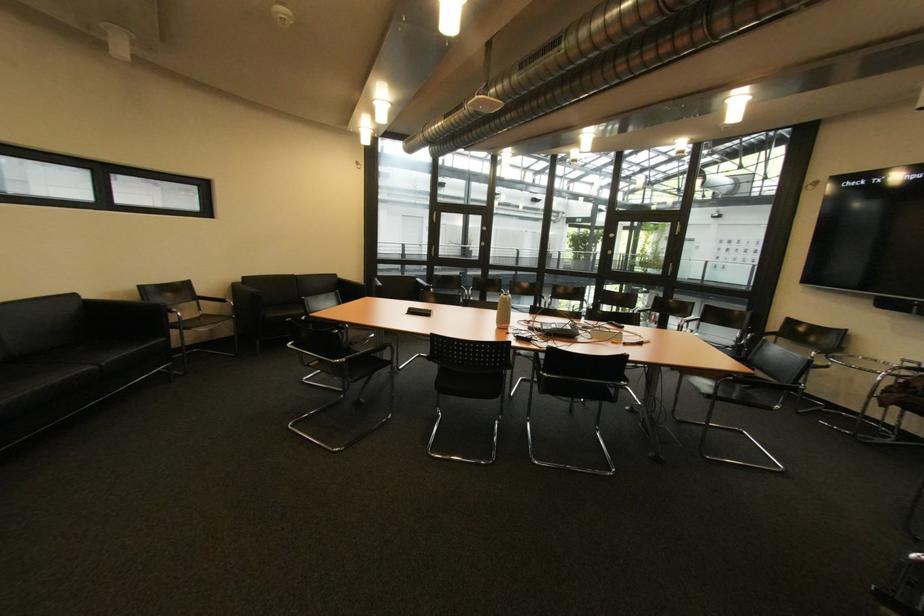
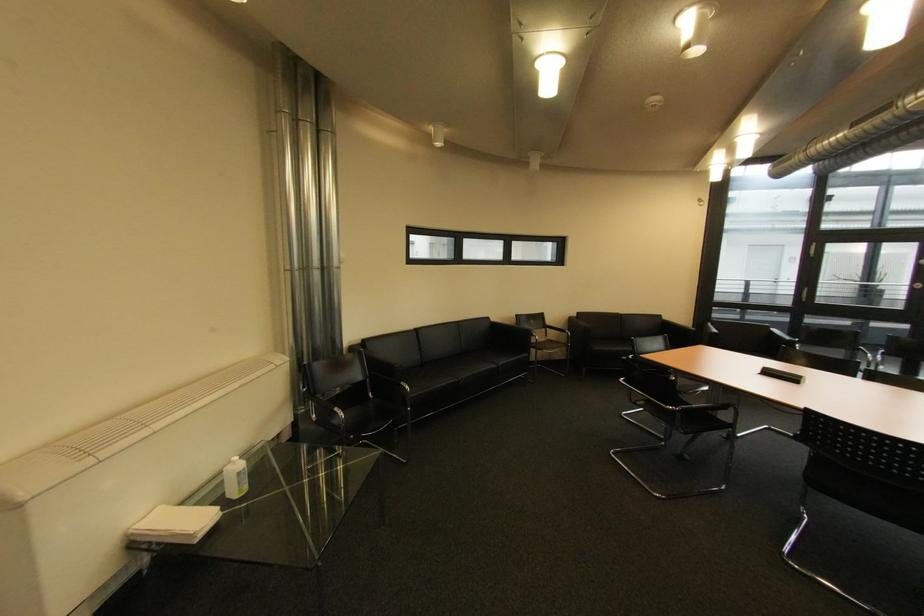
Locate, in the second image, the point that corresponds to (x=438, y=339) in the first image.

(809, 415)